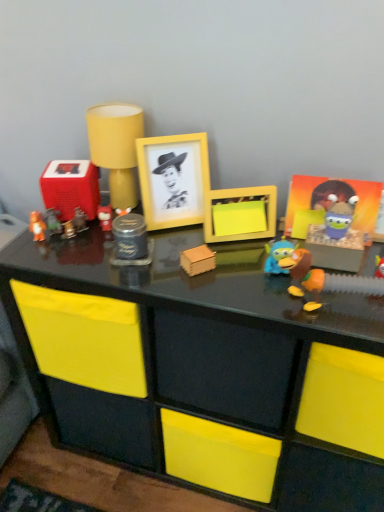
You are a GUI agent. You are given a task and a screenshot of the screen. Output one action in this format:
    pyautogui.click(x=<x>, y=<y>)
    Task: Click on the free space on the front side of metallic brown figurine at left, which ranks as the eighth toy in right-to-left order
    The height and width of the screenshot is (512, 384).
    Given the screenshot: What is the action you would take?
    pyautogui.click(x=107, y=264)